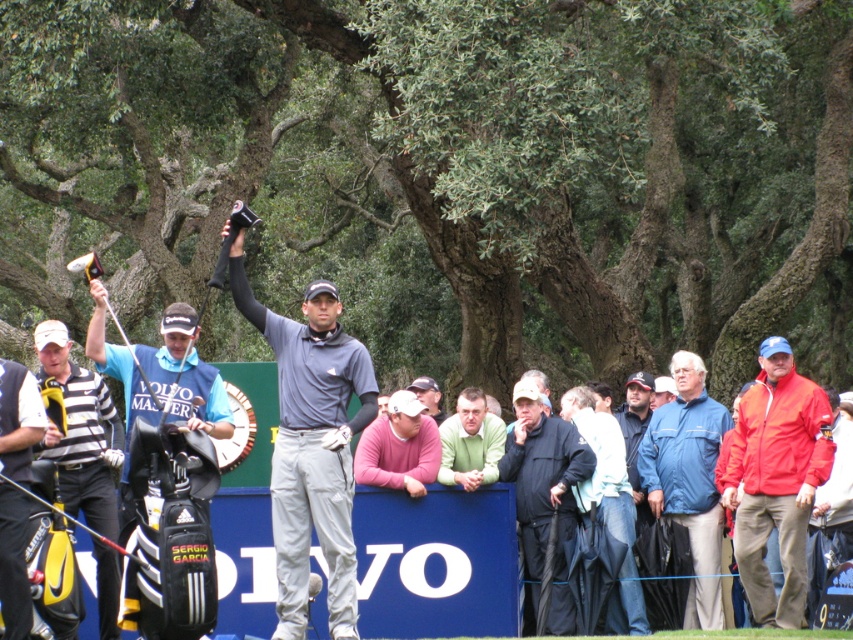
You are a photographer at the golf tournament and want to capture a wide shot that includes both the black leather golf bag at left and the pink sweater at center. The camera can only focus on objects within a 1.5 meter width. Can you fit both objects into the frame without moving the camera?

The black leather golf bag at left is narrower than the pink sweater at center. Since the camera can focus on objects within a 1.5 meter width, and the golf bag is narrower than the sweater, both objects can likely fit within the frame as long as their combined width does not exceed 1.5 meters. However, the exact fit depends on the individual widths of each object.

You are a photographer at the golf tournament. You want to take a photo of the golfer celebrating and the person next to him. The golfer is at point (x=316, y=508) and the other person is at point (x=618, y=429). Which point is closer to you, the photographer?

Point (x=316, y=508) is closer to the photographer than point (x=618, y=429).